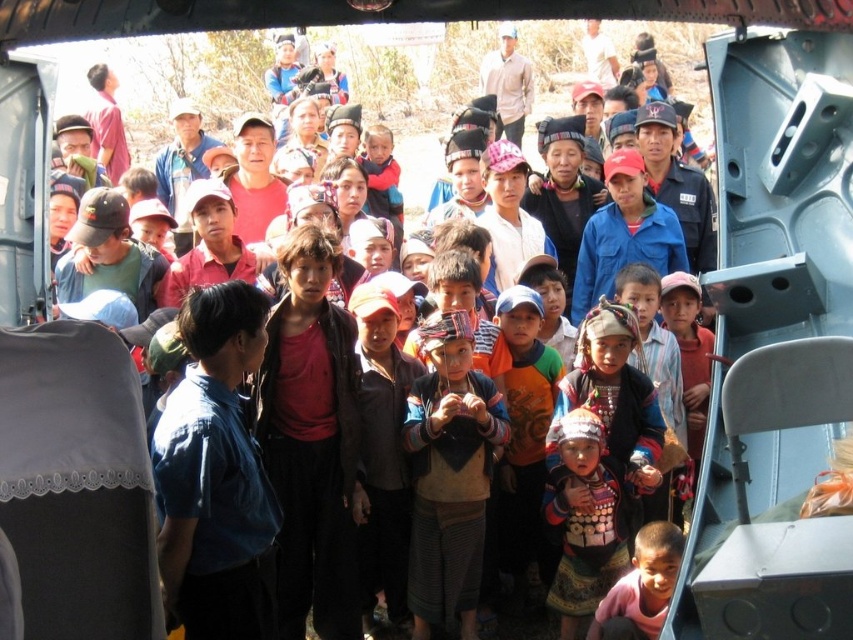
Question: Which point is farther to the camera?

Choices:
 (A) (648, 628)
 (B) (450, 422)

Answer: (B)

Question: Among these points, which one is farthest from the camera?

Choices:
 (A) (596, 628)
 (B) (428, 492)

Answer: (B)

Question: Is multicolored fabric at center further to the viewer compared to pink fabric shirt at lower right?

Choices:
 (A) yes
 (B) no

Answer: (A)

Question: Is multicolored fabric at center above pink fabric shirt at lower right?

Choices:
 (A) yes
 (B) no

Answer: (A)

Question: Which point is closer to the camera?

Choices:
 (A) pink fabric shirt at lower right
 (B) multicolored fabric at center

Answer: (A)

Question: Can you confirm if multicolored fabric at center is thinner than pink fabric shirt at lower right?

Choices:
 (A) no
 (B) yes

Answer: (A)